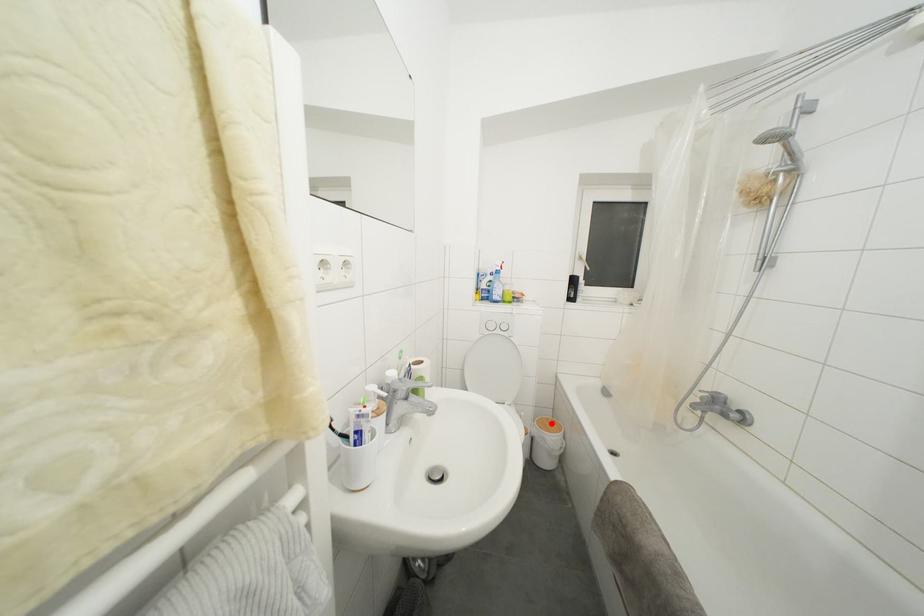
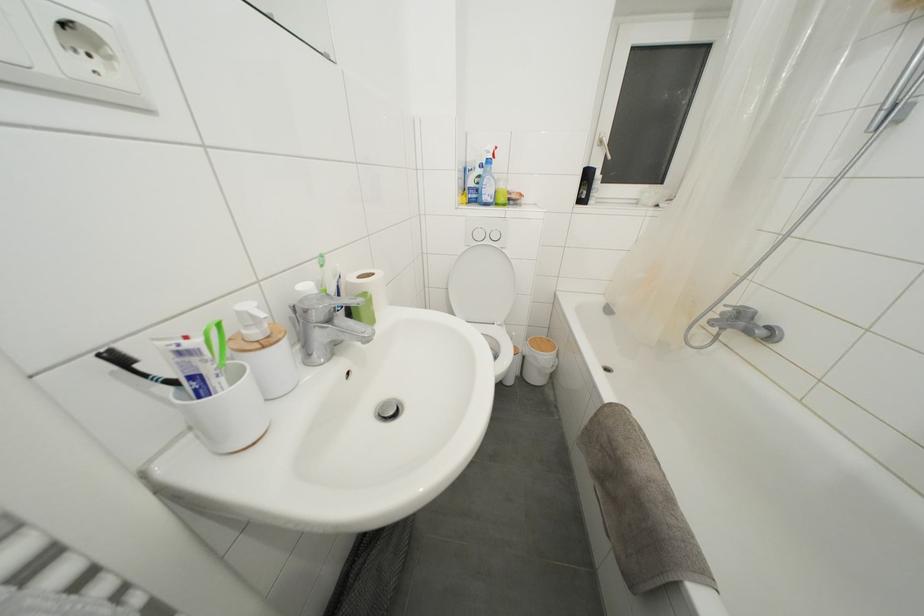
In the second image, find the point that corresponds to the highlighted location in the first image.

(544, 342)